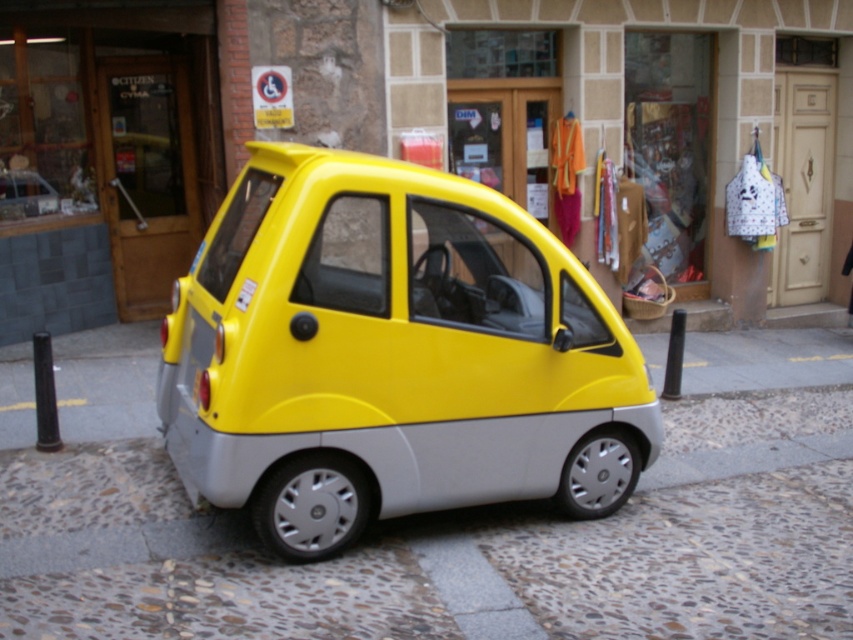
You are standing in front of the car parked between two bollards. There are two points marked on the car, one at coordinate point (0, 428) and the other at point (494, 461). Which point is closer to you?

Point (0, 428) is further to the camera than point (494, 461), so the point closer to you is point (494, 461).

You are standing at the origin point of the image coordinate system. The car is located at point 0.556, 0.460. If you want to walk directly to the yellow matte car at center, which direction should you move in?

You should move in the direction of the coordinates (x=392, y=355) to reach the yellow matte car at center.

You are a delivery person trying to unload a package from the yellow matte car at center. You need to place it on the yellow matte pavement at lower center. Is the pavement below the car sufficient to hold the package?

The yellow matte pavement at lower center is below the yellow matte car at center, so yes, the pavement is positioned directly underneath the car and can hold the package.